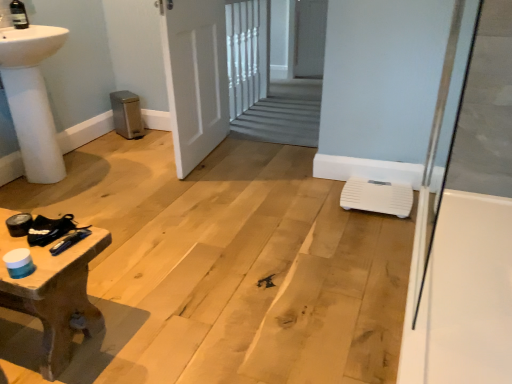
The width and height of the screenshot is (512, 384). What are the coordinates of `vacant space behind wooden textured table at lower left` in the screenshot? It's located at (129, 248).